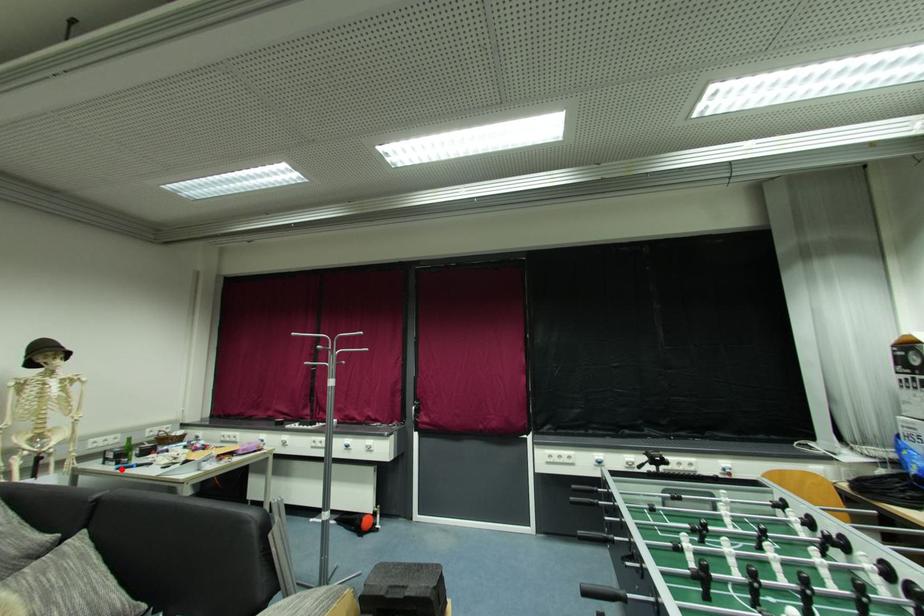
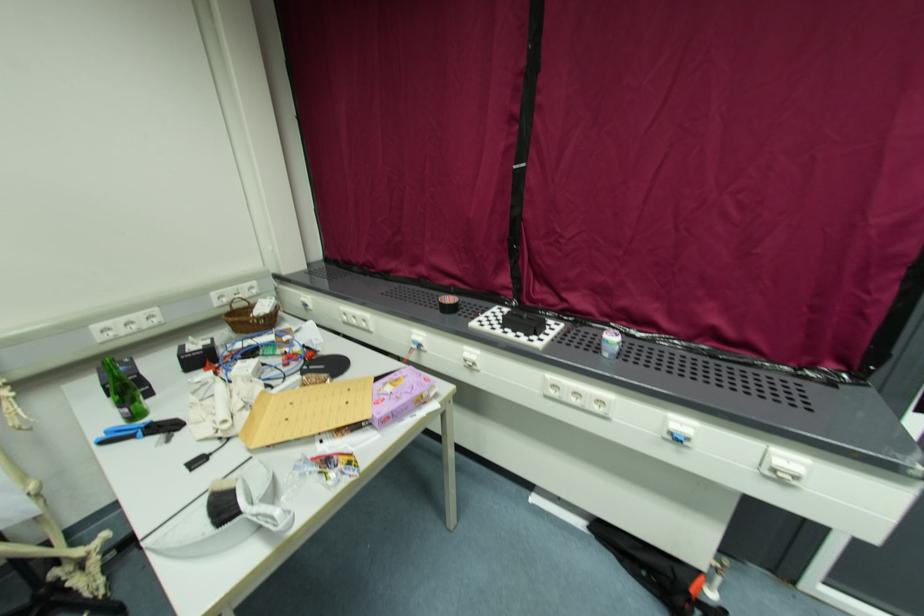
The point at the highlighted location is marked in the first image. Where is the corresponding point in the second image?

(107, 443)